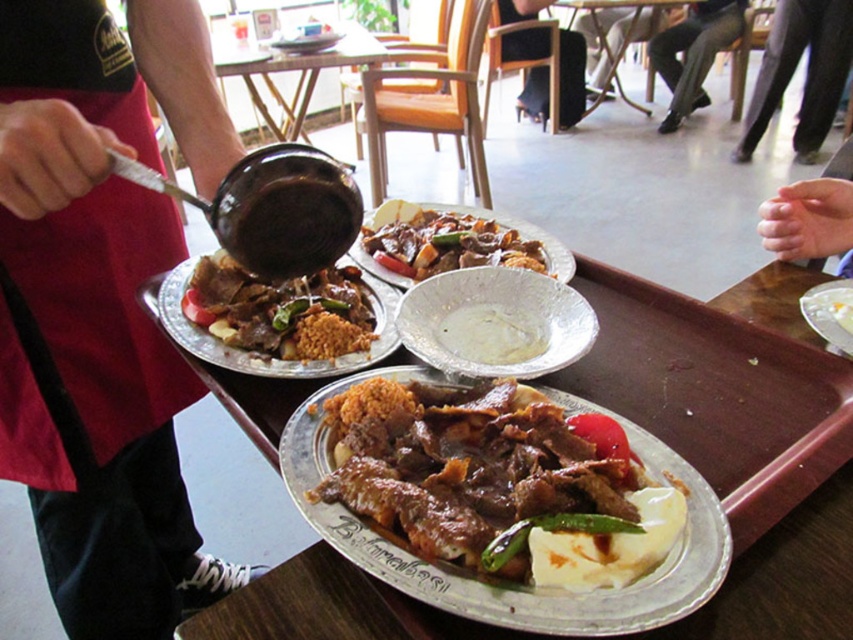
The height and width of the screenshot is (640, 853). What do you see at coordinates (570, 77) in the screenshot?
I see `black leather pants at lower center` at bounding box center [570, 77].

How distant is black leather pants at lower center from white creamy mashed potato at center?

A distance of 3.94 meters exists between black leather pants at lower center and white creamy mashed potato at center.

Is point (532, 74) closer to viewer compared to point (833, 316)?

No, it is not.

This screenshot has width=853, height=640. I want to click on black leather pants at lower center, so click(x=570, y=77).

Between silver metallic tray at center and black pants at lower right, which one has more height?

black pants at lower right is taller.

Does silver metallic tray at center appear under black pants at lower right?

Indeed, silver metallic tray at center is positioned under black pants at lower right.

At what (x,y) coordinates should I click in order to perform the action: click on silver metallic tray at center. Please return your answer as a coordinate pair (x, y). Looking at the image, I should click on (721, 387).

Find the location of a particular element. This screenshot has width=853, height=640. silver metallic tray at center is located at coordinates (721, 387).

Describe the element at coordinates (440, 243) in the screenshot. I see `brown meaty stew at center` at that location.

This screenshot has width=853, height=640. Identify the location of brown meaty stew at center. (440, 243).